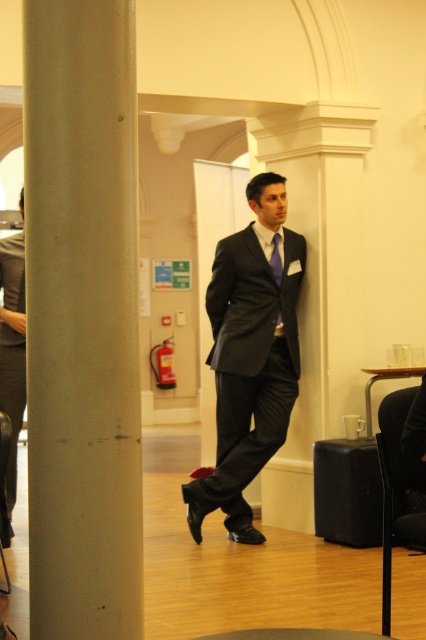
Question: Considering the relative positions of black plastic chair at lower right and silky blue tie at center in the image provided, where is black plastic chair at lower right located with respect to silky blue tie at center?

Choices:
 (A) left
 (B) right

Answer: (B)

Question: Which object is the closest to the dark gray suit at center?

Choices:
 (A) smooth beige pillar at left
 (B) silky blue tie at center

Answer: (B)

Question: Which point is farther to the camera?

Choices:
 (A) black plastic chair at lower right
 (B) matte black suit at center
 (C) silky blue tie at center

Answer: (C)

Question: Among these points, which one is farthest from the camera?

Choices:
 (A) pos(382,461)
 (B) pos(296,284)
 (C) pos(273,259)
 (D) pos(103,88)

Answer: (B)

Question: Is smooth beige pillar at left thinner than dark gray suit at center?

Choices:
 (A) no
 (B) yes

Answer: (B)

Question: From the image, what is the correct spatial relationship of smooth beige pillar at left in relation to matte black suit at center?

Choices:
 (A) above
 (B) below

Answer: (A)